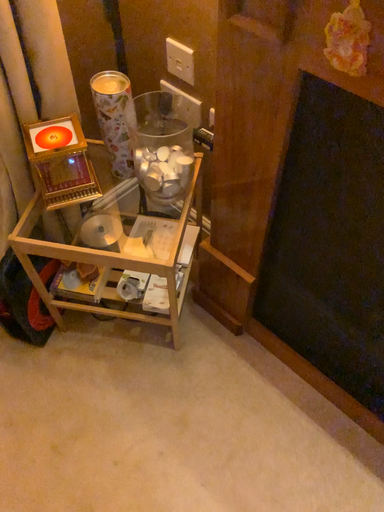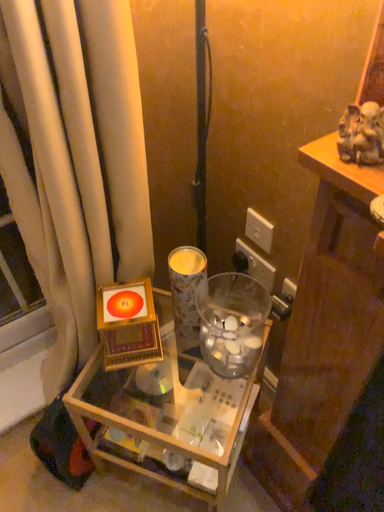
Question: Which way did the camera rotate in the video?

Choices:
 (A) rotated downward
 (B) rotated upward

Answer: (B)